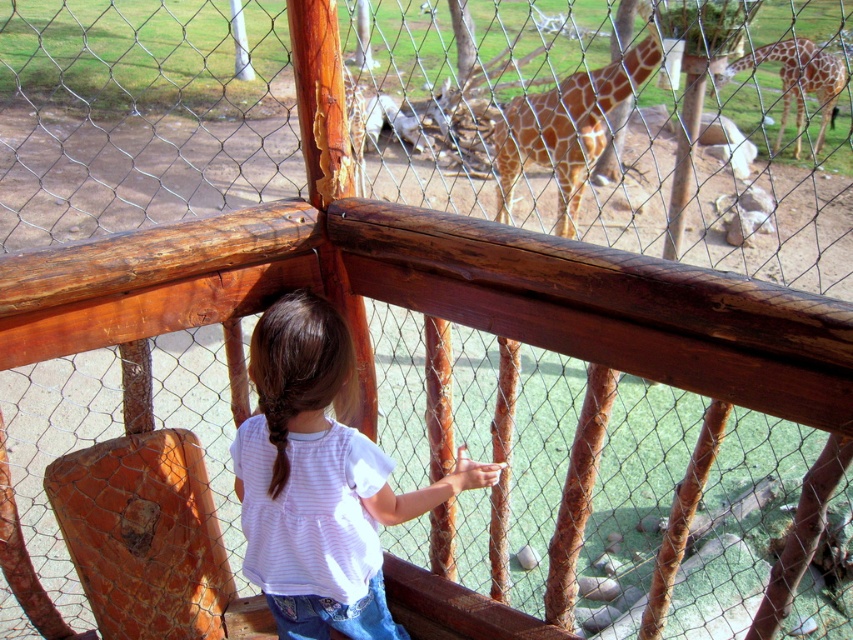
This screenshot has width=853, height=640. Find the location of `spotted brown giraffe at center`. spotted brown giraffe at center is located at coordinates (567, 125).

Who is positioned more to the right, spotted brown giraffe at center or spotted fur giraffe at upper right?

Positioned to the right is spotted fur giraffe at upper right.

Image resolution: width=853 pixels, height=640 pixels. Describe the element at coordinates (567, 125) in the screenshot. I see `spotted brown giraffe at center` at that location.

Identify the location of spotted brown giraffe at center. The image size is (853, 640). (567, 125).

Does white striped shirt at center come in front of spotted fur giraffe at upper right?

Yes, it is in front of spotted fur giraffe at upper right.

Consider the image. Which is below, white striped shirt at center or spotted fur giraffe at upper right?

white striped shirt at center

Locate an element on the screen. The image size is (853, 640). white striped shirt at center is located at coordinates 320,481.

Who is higher up, white striped shirt at center or spotted brown giraffe at center?

spotted brown giraffe at center is higher up.

Can you confirm if white striped shirt at center is positioned below spotted brown giraffe at center?

Yes.

Describe the element at coordinates (320, 481) in the screenshot. I see `white striped shirt at center` at that location.

Where is `white striped shirt at center`? Image resolution: width=853 pixels, height=640 pixels. white striped shirt at center is located at coordinates (320, 481).